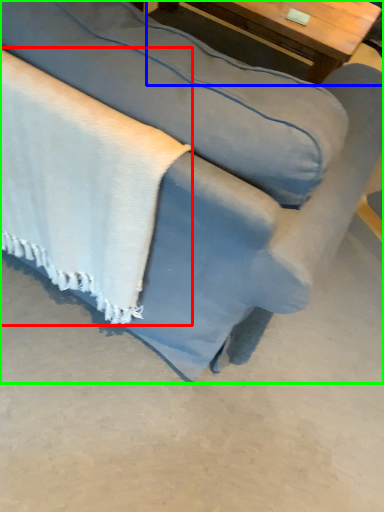
Question: Estimate the real-world distances between objects in this image. Which object is farther from blanket (highlighted by a red box), table (highlighted by a blue box) or studio couch (highlighted by a green box)?

Choices:
 (A) table
 (B) studio couch

Answer: (A)